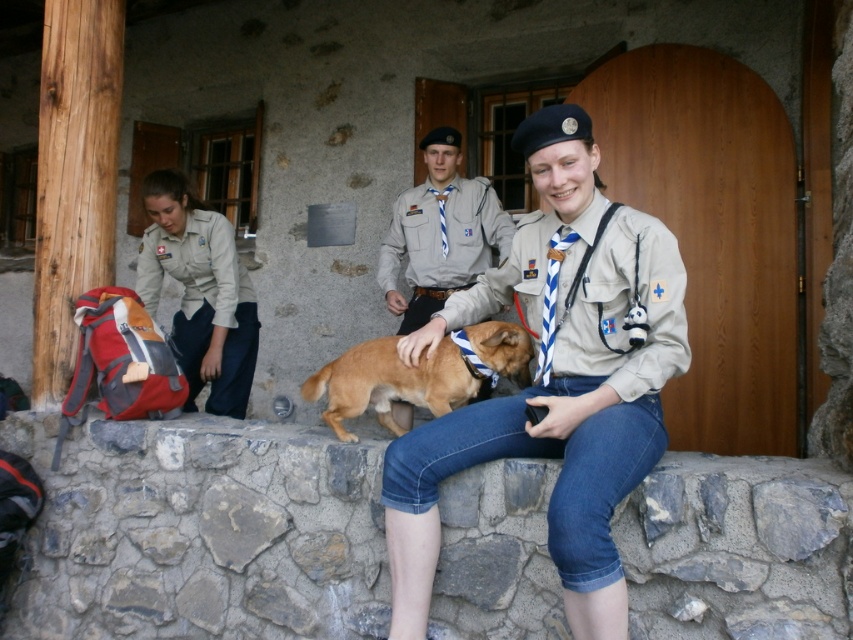
You are a scout leader trying to hand out a badge to the scout wearing the khaki fabric shirt at center. You are currently standing 1.85 meters away from them. Can you reach them without moving closer?

The distance between you and the scout wearing the khaki fabric shirt at center is 1.85 meters. Since the average human arm reach is about 1.5 meters, you would need to move closer to hand the badge.